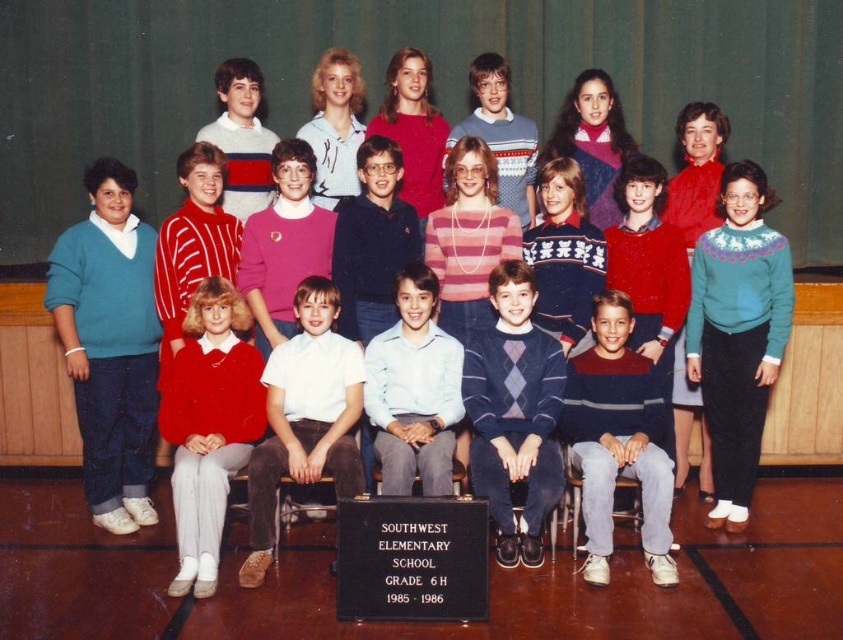
Question: Which object is farther from the camera taking this photo?

Choices:
 (A) dark blue argyle sweater at center
 (B) black polished wood plaque at center
 (C) light blue shirt at center
 (D) striped knit sweater at center

Answer: (D)

Question: Which is nearer to the white cotton shirt at center?

Choices:
 (A) light blue shirt at center
 (B) dark blue argyle sweater at center

Answer: (A)

Question: In this image, where is striped knit sweater at center located relative to light blue shirt at center?

Choices:
 (A) above
 (B) below

Answer: (B)

Question: Where is striped knit sweater at center located in relation to light blue shirt at center in the image?

Choices:
 (A) left
 (B) right

Answer: (B)

Question: Estimate the real-world distances between objects in this image. Which object is closer to the black polished wood plaque at center?

Choices:
 (A) dark blue argyle sweater at center
 (B) light blue shirt at center
 (C) white cotton shirt at center

Answer: (B)

Question: Does black polished wood plaque at center have a lesser width compared to light blue shirt at center?

Choices:
 (A) no
 (B) yes

Answer: (A)